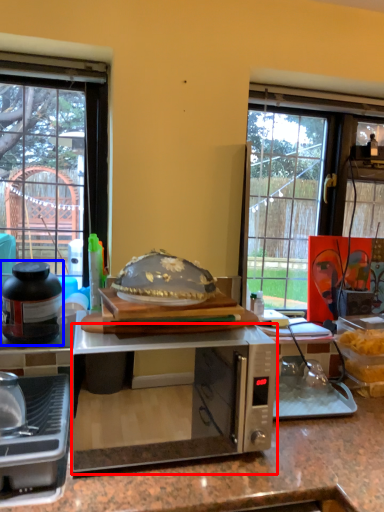
Question: Which object is closer to the camera taking this photo, microwave oven (highlighted by a red box) or kitchen appliance (highlighted by a blue box)?

Choices:
 (A) microwave oven
 (B) kitchen appliance

Answer: (A)